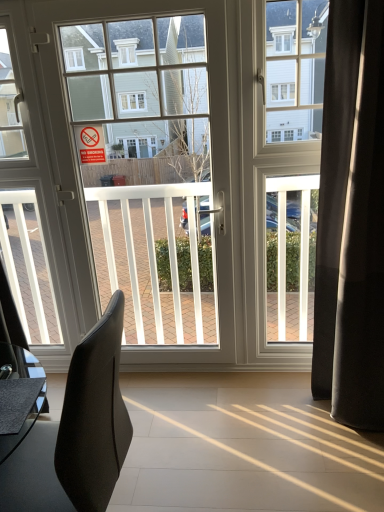
In order to click on free space in front of black fabric curtain at right in this screenshot , I will do `click(350, 457)`.